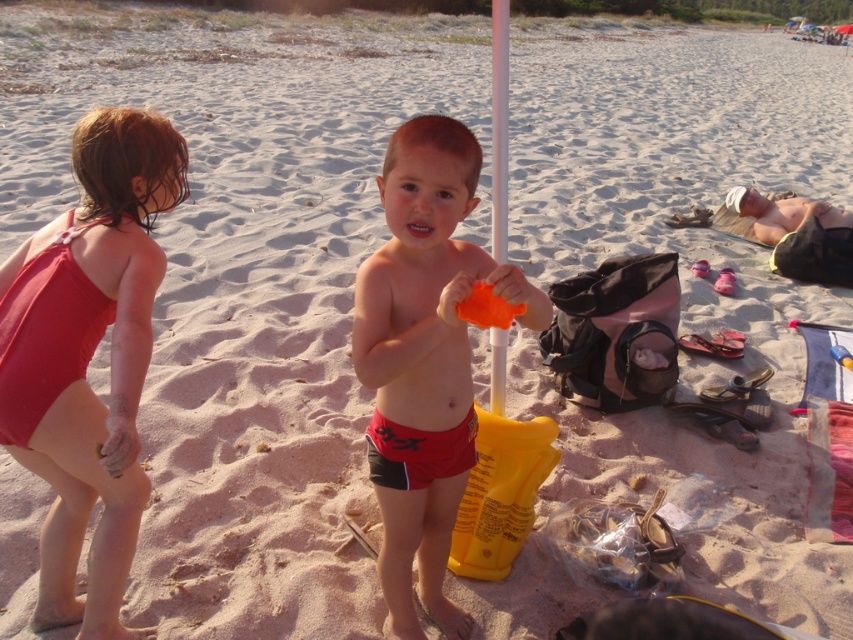
You are a parent at the beach and need to choose between two items to give to your child. The items are the matte red swimsuit at left and the matte red shorts at center. Which item is taller?

The matte red swimsuit at left is much taller than the matte red shorts at center.